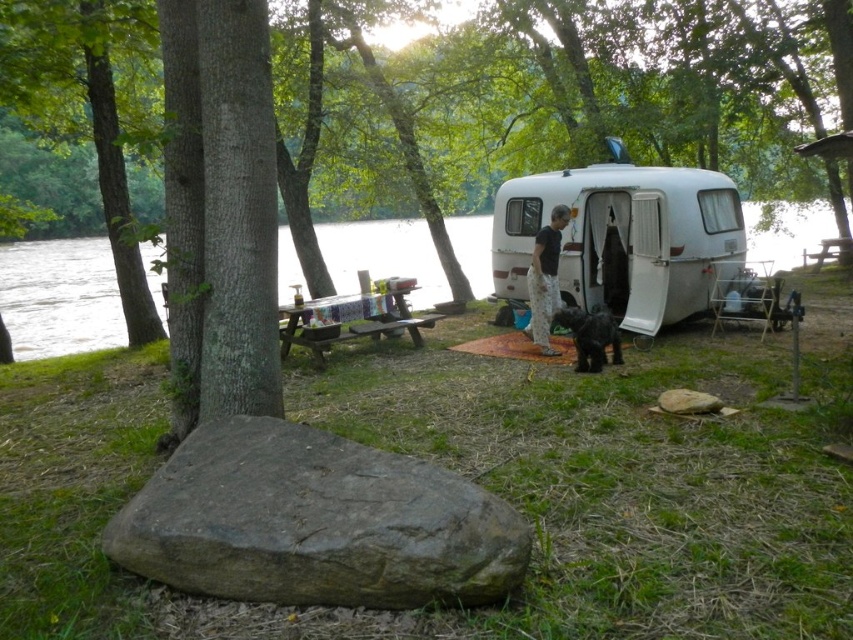
You are planning to take a walk along the river and want to avoid getting your shoes wet. Which object should you step around to stay dry? The clear water at center or the black fuzzy dog at center?

You should step around the clear water at center since it is positioned on the left side of the black fuzzy dog at center, indicating it is closer to the river and more likely to be wet.

You are planning to set up a tent in this camping area. The tent requires a space wider than the wooden picnic table at center. Can the clear water at center provide enough width for your tent setup?

The clear water at center has a width larger than the wooden picnic table at center, so it can provide enough space for the tent setup.

You are planning to set up a tent in this camping area. You have a tent that requires a flat, dry area larger than the wooden picnic table at center. Can the clear water at center be used as a suitable spot for your tent?

The clear water at center is above the wooden picnic table at center, which means it is not a flat or dry area. Therefore, the clear water at center cannot be used as a suitable spot for your tent.